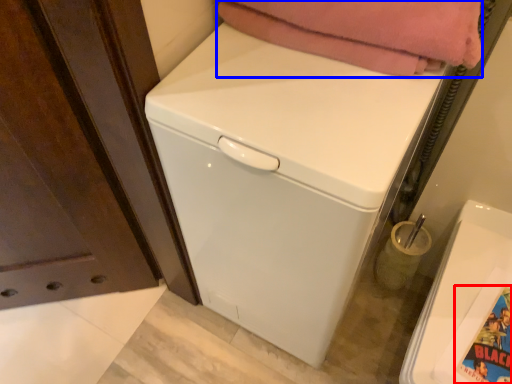
Question: Which point is further to the camera, comic book character (highlighted by a red box) or blanket (highlighted by a blue box)?

Choices:
 (A) comic book character
 (B) blanket

Answer: (A)